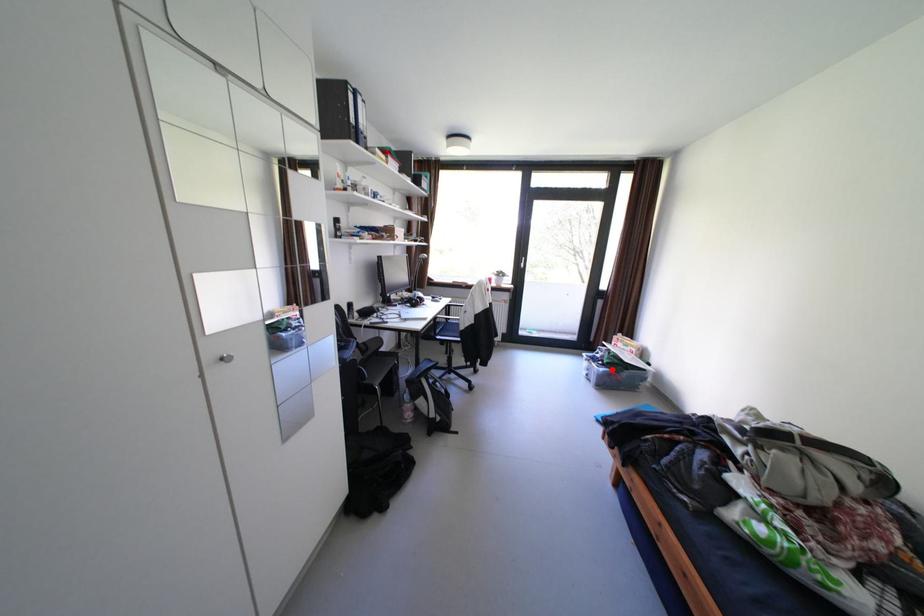
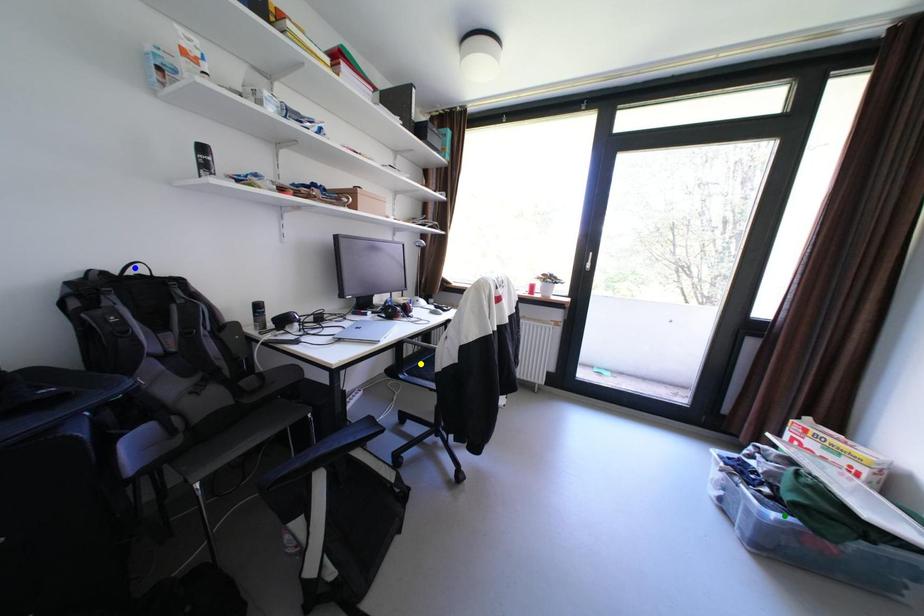
Question: I am providing you with two images of the same scene from different viewpoints. A red point is marked on the first image. You are given multiple points on the second image. Which point in image 2 represents the same 3d spot as the red point in image 1?

Choices:
 (A) green point
 (B) blue point
 (C) yellow point

Answer: (A)